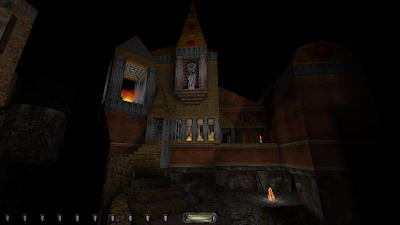
Locate an element on the screen. This screenshot has height=225, width=400. statue is located at coordinates (192, 72).